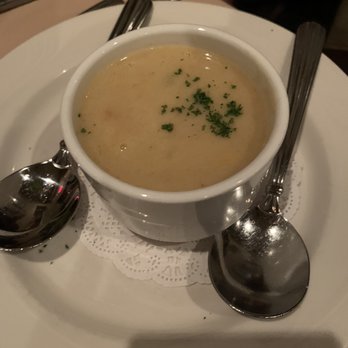
In order to click on handle in this screenshot , I will do click(x=312, y=67), click(x=123, y=28).